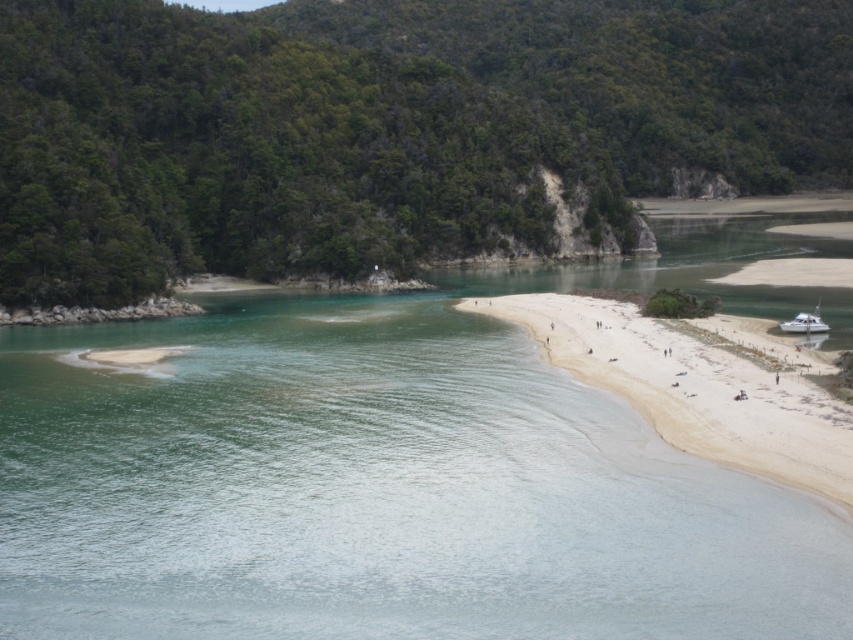
You are standing on the white sandy beach at lower right and want to reach the white glossy boat at lower right. Which direction should you move to get closer to the boat?

The white sandy beach at lower right is below the white glossy boat at lower right, so you should move upward to reach the boat.

You are standing on the shore and want to walk from the white sandy beach at lower right to the white glossy boat at lower right. Which direction should you move to get from the beach to the boat?

Since the white sandy beach at lower right is wider than the white glossy boat at lower right, you should move towards the left to reach the boat from the beach.